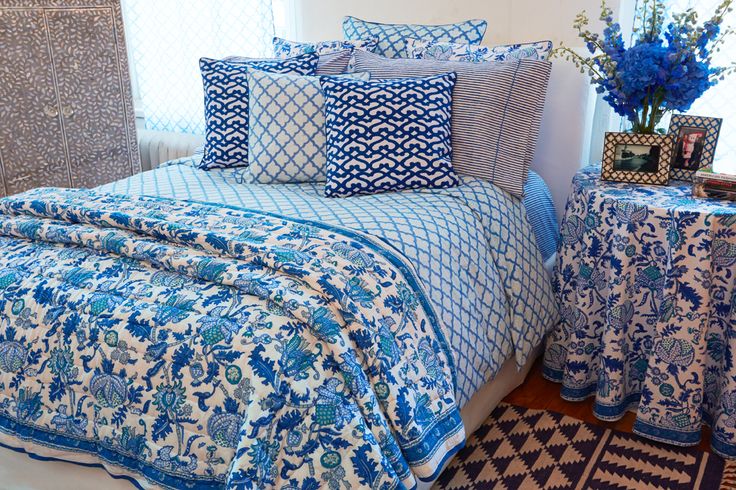
I want to click on area rug, so click(556, 457).